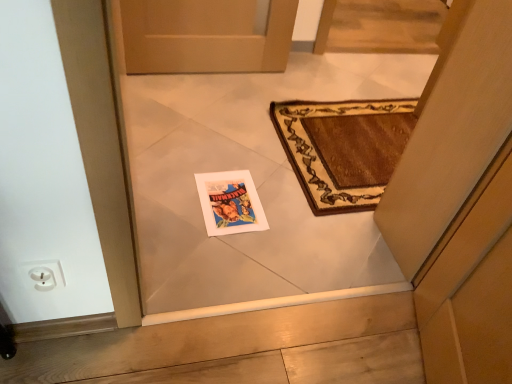
Describe the element at coordinates (230, 203) in the screenshot. The image size is (512, 384). I see `matte paper comic book at center` at that location.

Identify the location of matte paper comic book at center. The width and height of the screenshot is (512, 384). (230, 203).

The height and width of the screenshot is (384, 512). Find the location of `matte paper comic book at center`. matte paper comic book at center is located at coordinates (230, 203).